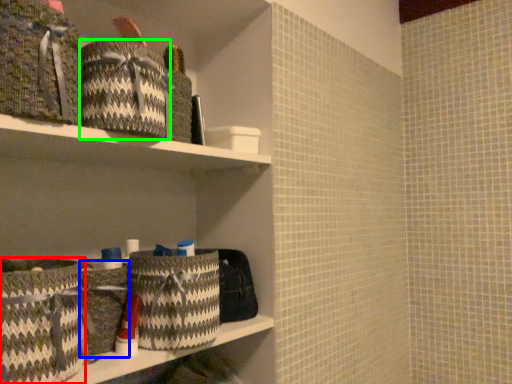
Question: Considering the real-world distances, which object is closest to basket (highlighted by a red box)? basket (highlighted by a blue box) or material (highlighted by a green box).

Choices:
 (A) basket
 (B) material

Answer: (A)